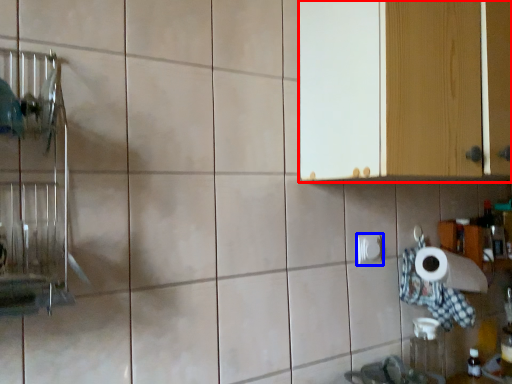
Question: Which point is closer to the camera, cabinetry (highlighted by a red box) or toilet paper (highlighted by a blue box)?

Choices:
 (A) cabinetry
 (B) toilet paper

Answer: (A)